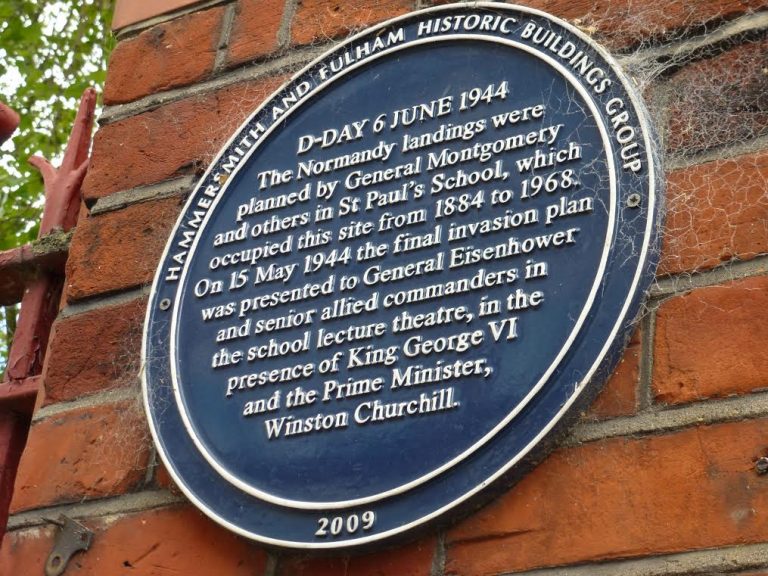
Image resolution: width=768 pixels, height=576 pixels. I want to click on wall, so click(616, 485).